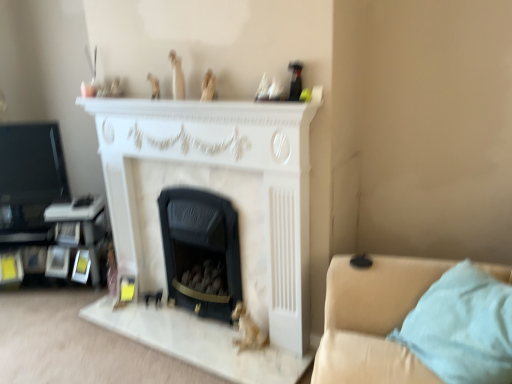
Where is `free space on the front side of gold metallic figurine at lower center, acting as the 1th toy starting from the right`? This screenshot has width=512, height=384. free space on the front side of gold metallic figurine at lower center, acting as the 1th toy starting from the right is located at coordinates (254, 369).